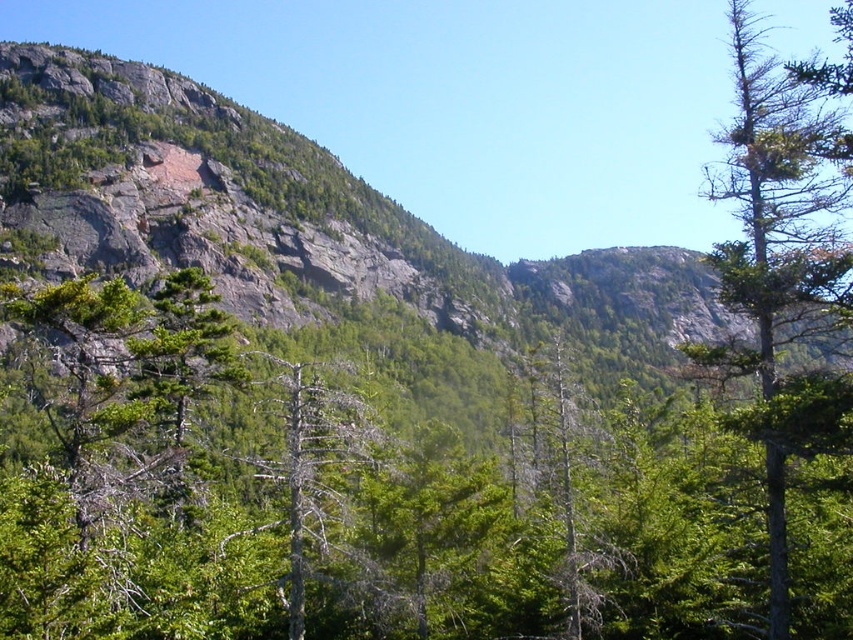
You are standing at the origin point of this mountain landscape. You want to walk towards the green leafy tree at center. Which direction should you move in? Please provide your answer in terms of coordinates relative to the origin point.

The green leafy tree at center is located at coordinates 0.772 in the x direction and 0.455 in the y direction from the origin point.